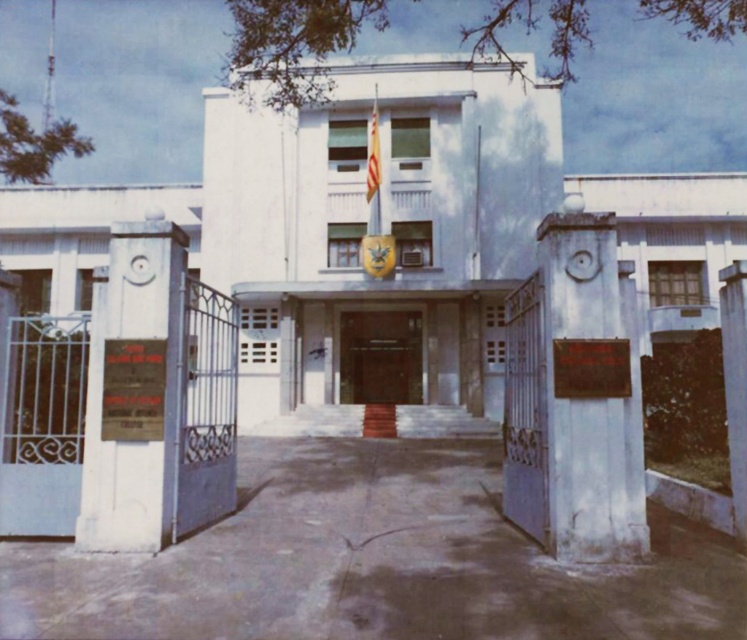
Does white stone plaque at left appear on the left side of brown wooden door at center?

Indeed, white stone plaque at left is positioned on the left side of brown wooden door at center.

Which of these two, white stone plaque at left or brown wooden door at center, stands shorter?

With less height is brown wooden door at center.

Identify the location of white stone plaque at left. This screenshot has width=747, height=640. (133, 392).

Looking at this image, who is shorter, white stone plaque at left or white concrete pillar at right?

Standing shorter between the two is white concrete pillar at right.

Does point (176, 228) lie behind point (737, 465)?

That is True.

Identify the location of white stone plaque at left. Image resolution: width=747 pixels, height=640 pixels. (133, 392).

Is point (554, 260) less distant than point (161, 227)?

Yes, it is.

Who is more distant from viewer, (580, 525) or (128, 323)?

The point (128, 323) is behind.

Where is `smooth gray stone plaque at center`? Image resolution: width=747 pixels, height=640 pixels. smooth gray stone plaque at center is located at coordinates (589, 394).